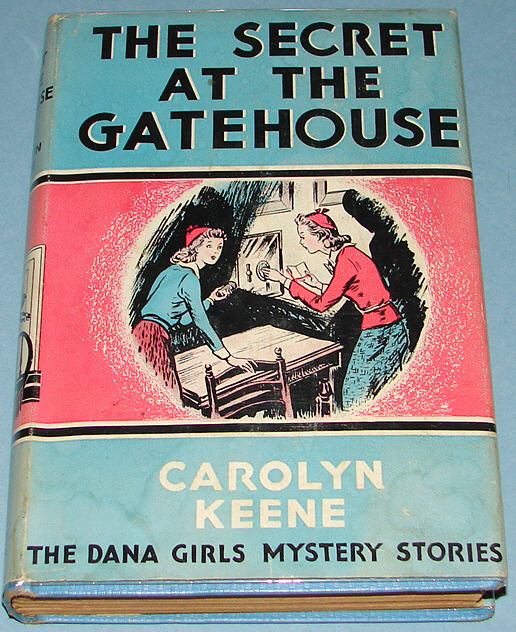
Where is `back of a wood chair`? back of a wood chair is located at coordinates (273, 385).